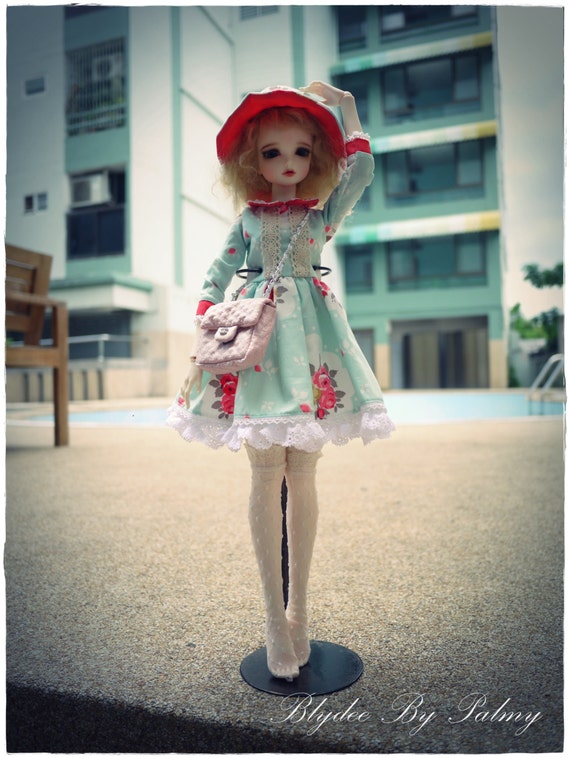
Locate an element on the screen. The height and width of the screenshot is (758, 570). wooden chair is located at coordinates (31, 356).